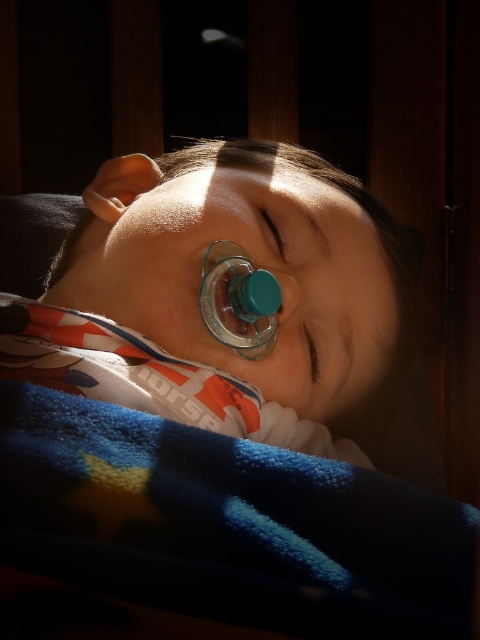
Question: Among these points, which one is farthest from the camera?

Choices:
 (A) (291, 291)
 (B) (304, 326)
 (C) (49, 561)
 (D) (283, 241)

Answer: (D)

Question: Is blue fleece blanket at lower left further to the viewer compared to matte plastic eye at center?

Choices:
 (A) yes
 (B) no

Answer: (B)

Question: Does matte plastic eye at center appear under brown matte eye at center?

Choices:
 (A) no
 (B) yes

Answer: (A)

Question: Considering the relative positions of matte plastic eye at center and brown matte eye at center in the image provided, where is matte plastic eye at center located with respect to brown matte eye at center?

Choices:
 (A) below
 (B) above

Answer: (B)

Question: Which of the following is the farthest from the observer?

Choices:
 (A) matte plastic eye at center
 (B) transparent plastic pacifier at center
 (C) brown matte eye at center

Answer: (C)

Question: Which point is closer to the camera?

Choices:
 (A) (257, 147)
 (B) (303, 333)
 (C) (165, 500)

Answer: (C)